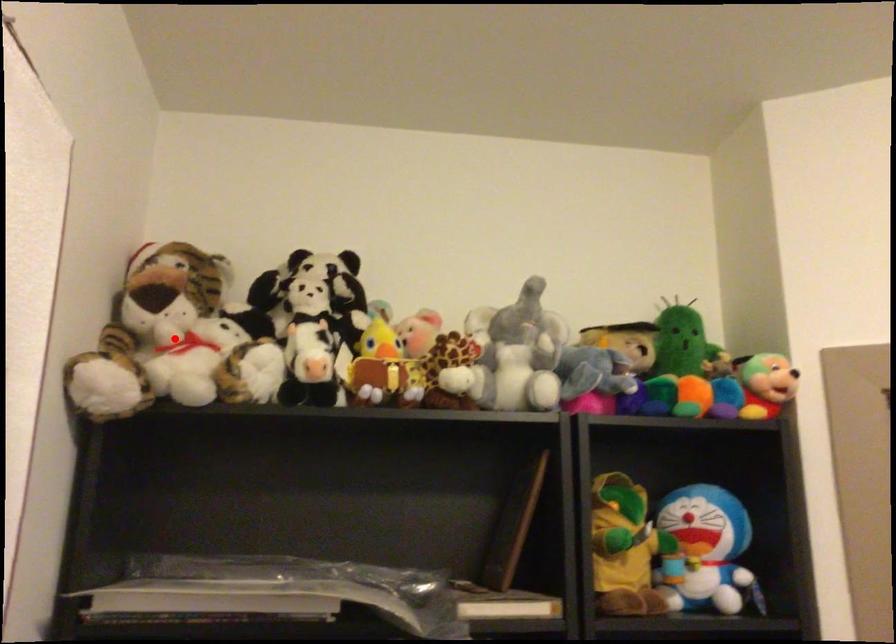
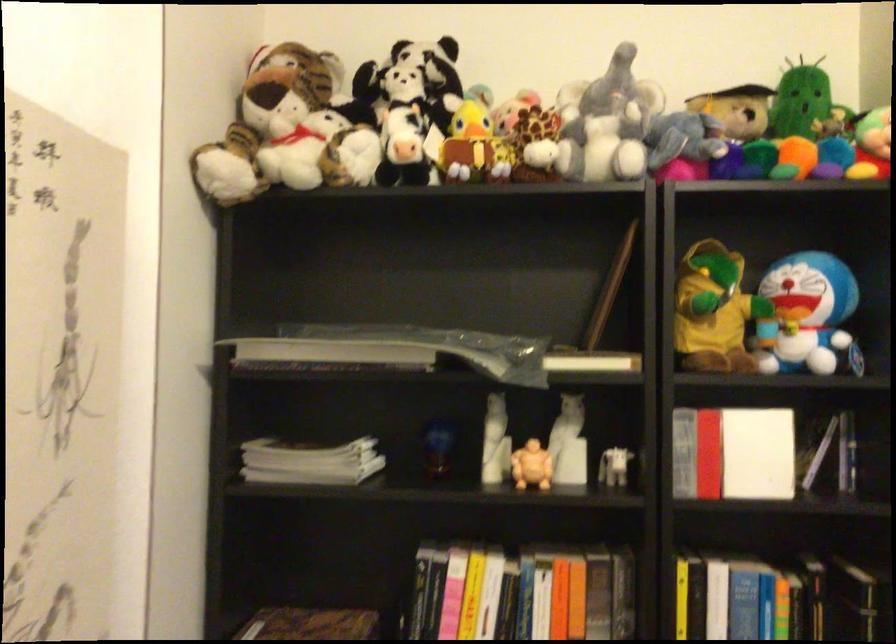
In the second image, find the point that corresponds to the highlighted location in the first image.

(289, 129)